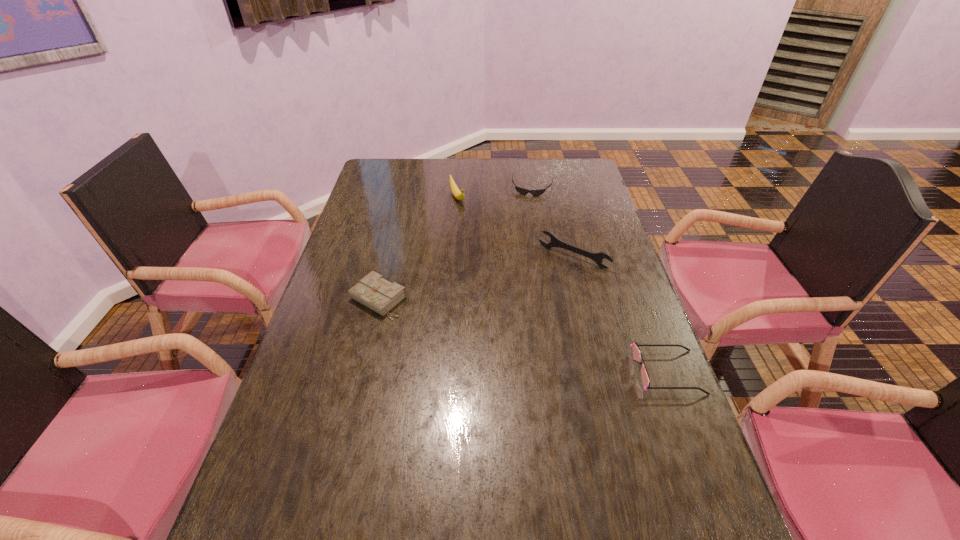
Where is `the fourth farthest object`? The height and width of the screenshot is (540, 960). the fourth farthest object is located at coordinates (373, 291).

The image size is (960, 540). I want to click on diary, so click(373, 291).

Locate an element on the screen. This screenshot has height=540, width=960. the taller sunglasses is located at coordinates (636, 352).

Where is `the nearer sunglasses`? This screenshot has width=960, height=540. the nearer sunglasses is located at coordinates (636, 352).

The height and width of the screenshot is (540, 960). I want to click on the second object from left to right, so click(456, 192).

The image size is (960, 540). In order to click on the tallest object in this screenshot , I will do 456,192.

In order to click on the third farthest object in this screenshot , I will do `click(598, 257)`.

Image resolution: width=960 pixels, height=540 pixels. I want to click on wrench, so click(598, 257).

Find the location of a particular element. The image size is (960, 540). the farther sunglasses is located at coordinates (522, 191).

This screenshot has width=960, height=540. Identify the location of the left sunglasses. (522, 191).